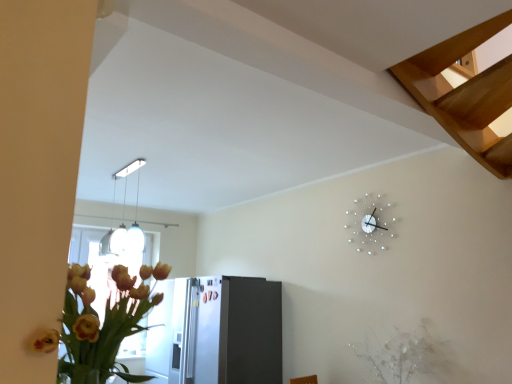
I want to click on white metallic clock at upper right, so click(x=371, y=223).

What do you see at coordinates (403, 356) in the screenshot? I see `white textured plant at lower right` at bounding box center [403, 356].

Locate an element on the screen. The image size is (512, 384). satin silver refrigerator at lower center is located at coordinates (216, 331).

How many degrees apart are the facing directions of white metallic clock at upper right and light brown wooden stairs at upper right?

They differ by 137 degrees in their facing directions.

Looking at the image, does white metallic clock at upper right seem bigger or smaller compared to light brown wooden stairs at upper right?

Considering their sizes, white metallic clock at upper right takes up less space than light brown wooden stairs at upper right.

Is point (380, 227) positioned after point (479, 77)?

Yes, point (380, 227) is behind point (479, 77).

From a real-world perspective, which is physically above, white metallic clock at upper right or light brown wooden stairs at upper right?

In real-world perspective, light brown wooden stairs at upper right is above.

Does white textured plant at lower right turn towards satin silver refrigerator at lower center?

No, white textured plant at lower right does not turn towards satin silver refrigerator at lower center.

Locate an element on the screen. appliance located behind the white textured plant at lower right is located at coordinates (216, 331).

How far apart are white textured plant at lower right and satin silver refrigerator at lower center?

white textured plant at lower right is 4.67 feet away from satin silver refrigerator at lower center.

Do you think light brown wooden stairs at upper right is within white glossy pendant light at upper center, or outside of it?

light brown wooden stairs at upper right is spatially situated outside white glossy pendant light at upper center.

In the scene shown: Is light brown wooden stairs at upper right facing towards white glossy pendant light at upper center?

No, light brown wooden stairs at upper right is not facing towards white glossy pendant light at upper center.

Is light brown wooden stairs at upper right not close to white glossy pendant light at upper center?

Yes, light brown wooden stairs at upper right is far from white glossy pendant light at upper center.

Who is bigger, light brown wooden stairs at upper right or white glossy pendant light at upper center?

white glossy pendant light at upper center.

Considering the positions of point (251, 359) and point (117, 251), is point (251, 359) closer or farther from the camera than point (117, 251)?

Point (251, 359).

From the image's perspective, is satin silver refrigerator at lower center located above white glossy pendant light at upper center?

Actually, satin silver refrigerator at lower center appears below white glossy pendant light at upper center in the image.

Considering the relative sizes of satin silver refrigerator at lower center and white glossy pendant light at upper center in the image provided, is satin silver refrigerator at lower center bigger than white glossy pendant light at upper center?

Yes, satin silver refrigerator at lower center is bigger than white glossy pendant light at upper center.

Is light brown wooden stairs at upper right not inside white metallic clock at upper right?

Yes.

From a real-world perspective, is light brown wooden stairs at upper right positioned over white metallic clock at upper right based on gravity?

Correct, in the physical world, light brown wooden stairs at upper right is higher than white metallic clock at upper right.

Looking at this image, relative to white metallic clock at upper right, is light brown wooden stairs at upper right in front or behind?

light brown wooden stairs at upper right is in front of white metallic clock at upper right.

Between point (398, 75) and point (388, 238), which one is positioned behind?

The point (388, 238) is farther from the camera.

Is point (435, 355) positioned in front of point (377, 246)?

Yes.

From the image's perspective, which is below, white textured plant at lower right or white metallic clock at upper right?

white textured plant at lower right, from the image's perspective.

Who is smaller, white glossy pendant light at upper center or satin silver refrigerator at lower center?

With smaller size is white glossy pendant light at upper center.

Is white glossy pendant light at upper center oriented towards satin silver refrigerator at lower center?

No, white glossy pendant light at upper center is not facing towards satin silver refrigerator at lower center.

Is white glossy pendant light at upper center completely or partially outside of satin silver refrigerator at lower center?

That's correct, white glossy pendant light at upper center is outside of satin silver refrigerator at lower center.

From a real-world perspective, is white glossy pendant light at upper center positioned above or below satin silver refrigerator at lower center?

From a real-world perspective, white glossy pendant light at upper center is physically above satin silver refrigerator at lower center.

The image size is (512, 384). In order to click on stairs above the white metallic clock at upper right (from the image's perspective) in this screenshot , I will do `click(465, 94)`.

The image size is (512, 384). I want to click on plant located in front of the satin silver refrigerator at lower center, so click(x=403, y=356).

Which object lies nearer to the anchor point white metallic clock at upper right, light brown wooden stairs at upper right or white textured plant at lower right?

white textured plant at lower right is positioned closer to the anchor white metallic clock at upper right.

Which object lies nearer to the anchor point satin silver refrigerator at lower center, light brown wooden stairs at upper right or white textured plant at lower right?

white textured plant at lower right lies closer to satin silver refrigerator at lower center than the other object.

Looking at this image, estimate the real-world distances between objects in this image. Which object is closer to light brown wooden stairs at upper right, white metallic clock at upper right or white glossy pendant light at upper center?

The object closer to light brown wooden stairs at upper right is white metallic clock at upper right.

From the image, which object appears to be farther from white metallic clock at upper right, light brown wooden stairs at upper right or white glossy pendant light at upper center?

The object further to white metallic clock at upper right is white glossy pendant light at upper center.

Which object lies nearer to the anchor point white glossy pendant light at upper center, white metallic clock at upper right or light brown wooden stairs at upper right?

Among the two, white metallic clock at upper right is located nearer to white glossy pendant light at upper center.

Estimate the real-world distances between objects in this image. Which object is further from light brown wooden stairs at upper right, white glossy pendant light at upper center or white textured plant at lower right?

The object further to light brown wooden stairs at upper right is white glossy pendant light at upper center.

Which object lies nearer to the anchor point white textured plant at lower right, satin silver refrigerator at lower center or light brown wooden stairs at upper right?

satin silver refrigerator at lower center is closer to white textured plant at lower right.

Based on their spatial positions, is light brown wooden stairs at upper right or satin silver refrigerator at lower center further from white glossy pendant light at upper center?

light brown wooden stairs at upper right is further to white glossy pendant light at upper center.

Image resolution: width=512 pixels, height=384 pixels. I want to click on appliance situated between white glossy pendant light at upper center and light brown wooden stairs at upper right from left to right, so click(x=216, y=331).

I want to click on plant between white glossy pendant light at upper center and light brown wooden stairs at upper right, so click(403, 356).

In order to click on wall clock situated between satin silver refrigerator at lower center and white textured plant at lower right from left to right in this screenshot , I will do `click(371, 223)`.

This screenshot has width=512, height=384. Identify the location of wall clock between white glossy pendant light at upper center and white textured plant at lower right in the horizontal direction. (371, 223).